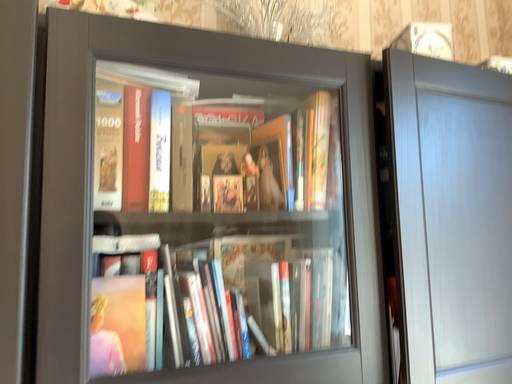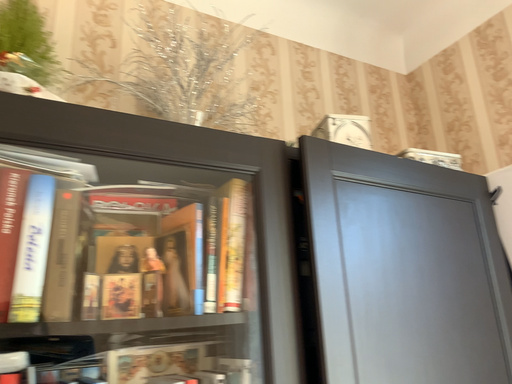
Question: How did the camera likely rotate when shooting the video?

Choices:
 (A) rotated downward
 (B) rotated upward

Answer: (B)